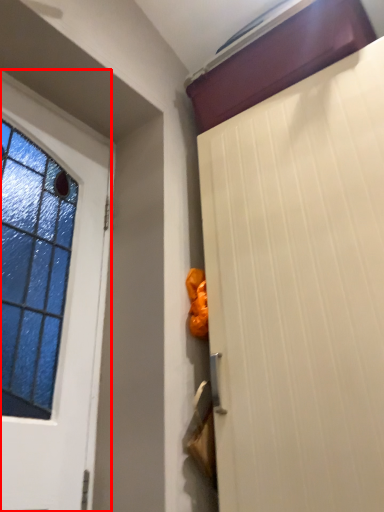
Question: In this image, where is door (annotated by the red box) located relative to door?

Choices:
 (A) left
 (B) right

Answer: (A)